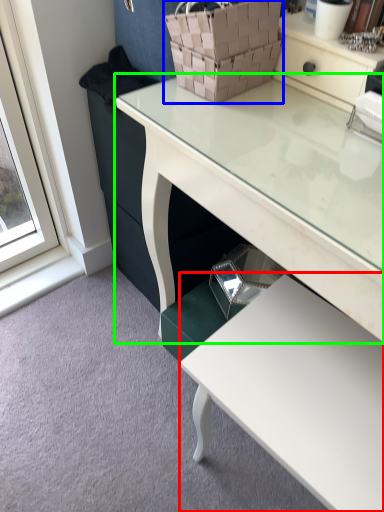
Question: Which object is positioned closest to table (highlighted by a red box)? Select from basket (highlighted by a blue box) and desk (highlighted by a green box).

Choices:
 (A) basket
 (B) desk

Answer: (B)